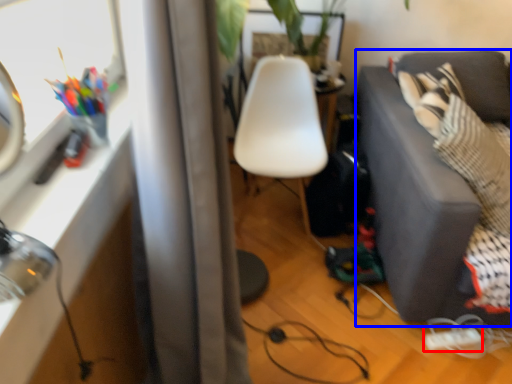
Question: Which object is further to the camera taking this photo, extension cord (highlighted by a red box) or studio couch (highlighted by a blue box)?

Choices:
 (A) extension cord
 (B) studio couch

Answer: (A)